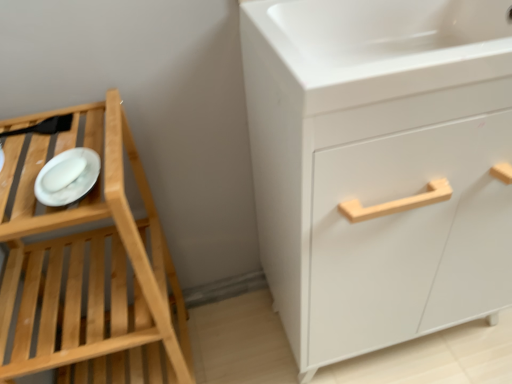
Question: Is white matte cabinet at right taller than natural wood tray at left?

Choices:
 (A) no
 (B) yes

Answer: (B)

Question: Does white matte cabinet at right contain natural wood tray at left?

Choices:
 (A) no
 (B) yes

Answer: (A)

Question: Could you tell me if white matte cabinet at right is facing natural wood tray at left?

Choices:
 (A) no
 (B) yes

Answer: (A)

Question: Is white matte cabinet at right looking in the opposite direction of natural wood tray at left?

Choices:
 (A) yes
 (B) no

Answer: (B)

Question: Is white matte cabinet at right not close to natural wood tray at left?

Choices:
 (A) no
 (B) yes

Answer: (A)

Question: From a real-world perspective, is white matte cabinet at right on natural wood tray at left?

Choices:
 (A) yes
 (B) no

Answer: (A)

Question: Does white matte cabinet at right have a greater width compared to white glossy sink at upper right?

Choices:
 (A) yes
 (B) no

Answer: (A)

Question: Is white matte cabinet at right to the right of white glossy sink at upper right from the viewer's perspective?

Choices:
 (A) no
 (B) yes

Answer: (B)

Question: Is white matte cabinet at right bigger than white glossy sink at upper right?

Choices:
 (A) yes
 (B) no

Answer: (A)

Question: From the image's perspective, is white matte cabinet at right below white glossy sink at upper right?

Choices:
 (A) yes
 (B) no

Answer: (A)

Question: Is white matte cabinet at right facing towards white glossy sink at upper right?

Choices:
 (A) no
 (B) yes

Answer: (A)

Question: Does white matte cabinet at right have a lesser width compared to white glossy sink at upper right?

Choices:
 (A) yes
 (B) no

Answer: (B)

Question: Is white matte cabinet at right thinner than white matte platter at left?

Choices:
 (A) no
 (B) yes

Answer: (A)